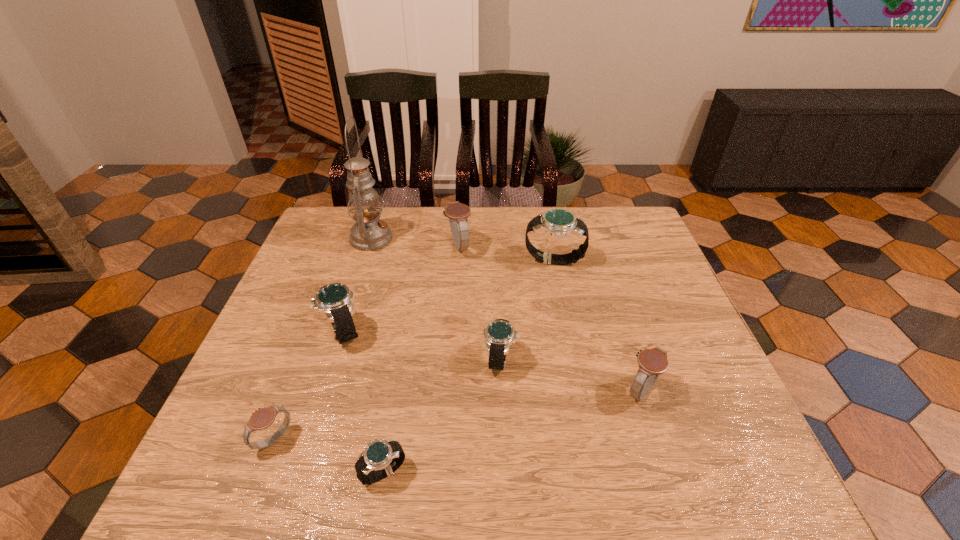
The image size is (960, 540). I want to click on free space between the smallest silver watch and the leftmost silver watch, so click(364, 402).

Locate an element on the screen. free space between the nearest silver watch and the second silver watch from right to left is located at coordinates (442, 416).

The height and width of the screenshot is (540, 960). What are the coordinates of `free spot between the farthest gray watch and the third watch from right to left` in the screenshot? It's located at (479, 303).

Locate an element on the screen. The image size is (960, 540). object that can be found as the fourth closest to the fourth object from right to left is located at coordinates (499, 334).

Identify which object is located as the seventh nearest to the leftmost silver watch. Please provide its 2D coordinates. Your answer should be formatted as a tuple, i.e. [(x, y)], where the tuple contains the x and y coordinates of a point satisfying the conditions above.

[(652, 362)]

Identify which watch is the fifth nearest to the fifth watch from left to right. Please provide its 2D coordinates. Your answer should be formatted as a tuple, i.e. [(x, y)], where the tuple contains the x and y coordinates of a point satisfying the conditions above.

[(458, 213)]

Select which watch appears as the third closest to the smallest gray watch. Please provide its 2D coordinates. Your answer should be formatted as a tuple, i.e. [(x, y)], where the tuple contains the x and y coordinates of a point satisfying the conditions above.

[(499, 334)]

This screenshot has width=960, height=540. What are the coordinates of `silver watch that is the third closest one to the smallest silver watch` in the screenshot? It's located at (558, 222).

This screenshot has height=540, width=960. I want to click on silver watch that stands as the fourth closest to the leftmost gray watch, so click(558, 222).

Find the location of a particular element. gray watch that can be found as the closest to the fourth object from right to left is located at coordinates click(652, 362).